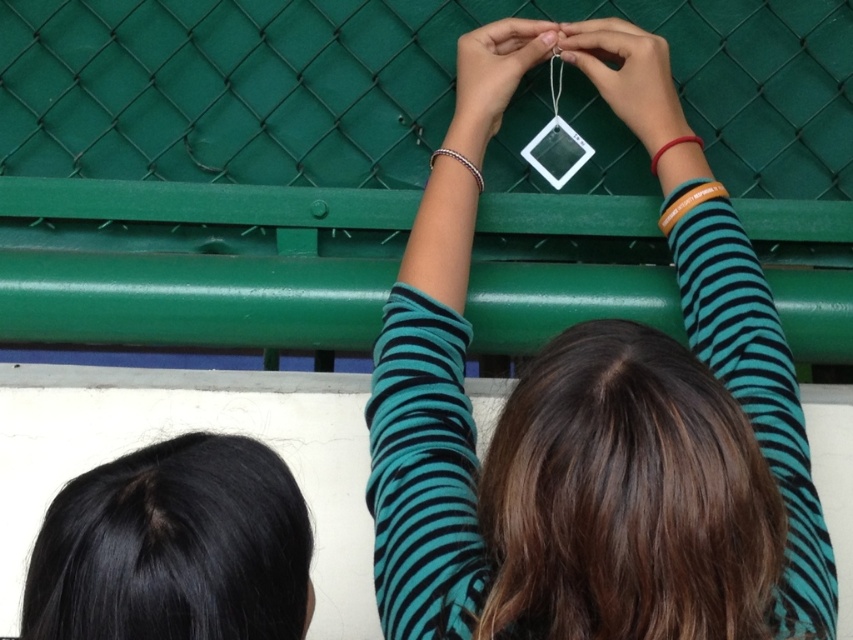
Question: Among these objects, which one is nearest to the camera?

Choices:
 (A) matte white tag at upper center
 (B) clear plastic diamond at center
 (C) black smooth hair at upper center

Answer: (C)

Question: Is clear plastic diamond at center closer to camera compared to matte white tag at upper center?

Choices:
 (A) no
 (B) yes

Answer: (B)

Question: Which of the following is the farthest from the observer?

Choices:
 (A) (763, 8)
 (B) (94, 500)
 (C) (466, 237)

Answer: (A)

Question: Does clear plastic diamond at center appear on the left side of black smooth hair at upper center?

Choices:
 (A) no
 (B) yes

Answer: (A)

Question: Can you confirm if black smooth hair at upper center is thinner than transparent plastic at upper center?

Choices:
 (A) yes
 (B) no

Answer: (B)

Question: Which object appears farthest from the camera in this image?

Choices:
 (A) matte white tag at upper center
 (B) green matte fence at center
 (C) black smooth hair at upper center

Answer: (B)